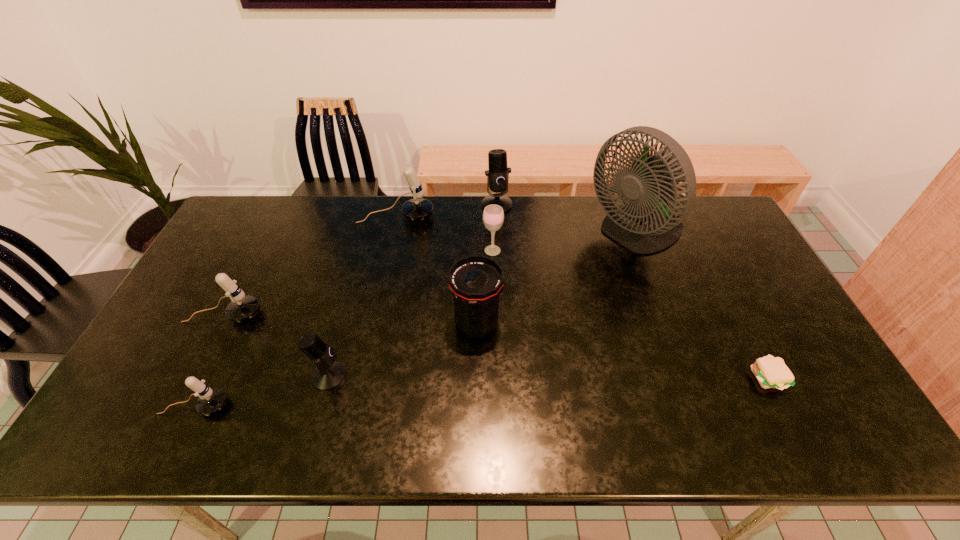
Image resolution: width=960 pixels, height=540 pixels. I want to click on vacant space located 0.140m on the left of the telephoto lens, so click(402, 322).

Where is `vacant space located 0.100m on the left of the wineglass`? The width and height of the screenshot is (960, 540). vacant space located 0.100m on the left of the wineglass is located at coordinates (452, 251).

The image size is (960, 540). Identify the location of blank space located on the back of the second nearest white microphone. (261, 244).

The image size is (960, 540). Find the location of `free spot located on the stand of the smaller black microphone`. free spot located on the stand of the smaller black microphone is located at coordinates (495, 376).

At what (x,y) coordinates should I click in order to perform the action: click on free space located 0.120m on the back of the eighth tallest object. Please return your answer as a coordinate pair (x, y). Looking at the image, I should click on (221, 353).

You are a GUI agent. You are given a task and a screenshot of the screen. Output one action in this format:
    pyautogui.click(x=<x>, y=<y>)
    Task: Click on the free space located 0.280m on the back of the shortest object
    This screenshot has height=540, width=960.
    Given the screenshot: What is the action you would take?
    pyautogui.click(x=719, y=283)

This screenshot has height=540, width=960. Find the location of `fan situated at the far edge`. fan situated at the far edge is located at coordinates (647, 224).

At what (x,y) coordinates should I click in order to perform the action: click on object situated at the near edge. Please return your answer as a coordinate pair (x, y). The width and height of the screenshot is (960, 540). Looking at the image, I should click on (210, 401).

You are a GUI agent. You are given a task and a screenshot of the screen. Output one action in this format:
    pyautogui.click(x=<x>, y=<y>)
    Task: Click on the object located in the right edge section of the desktop
    The width and height of the screenshot is (960, 540).
    Given the screenshot: What is the action you would take?
    pyautogui.click(x=771, y=372)

Where is `object present at the near left corner`? The height and width of the screenshot is (540, 960). object present at the near left corner is located at coordinates (210, 401).